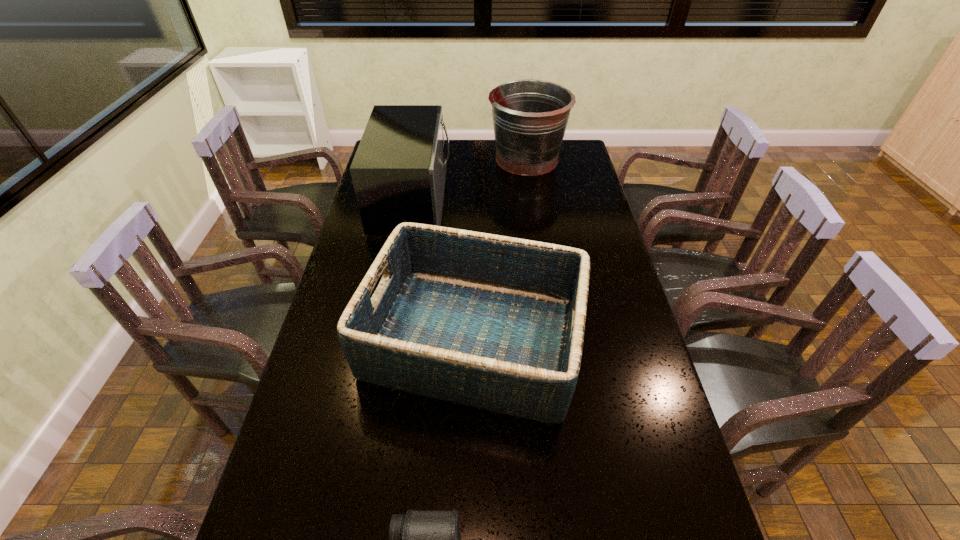
I want to click on bucket that is at the right edge, so click(530, 117).

Locate an element on the screen. The width and height of the screenshot is (960, 540). basket positioned at the right edge is located at coordinates (493, 322).

This screenshot has height=540, width=960. Find the location of `object situated at the far right corner`. object situated at the far right corner is located at coordinates (530, 117).

At what (x,y) coordinates should I click in order to perform the action: click on free space at the left edge. Please return your answer as a coordinate pair (x, y). Looking at the image, I should click on (x=335, y=311).

Find the location of `vacant space at the right edge of the desktop`. vacant space at the right edge of the desktop is located at coordinates (592, 299).

Find the location of a particular element. vacant region at the far right corner of the desktop is located at coordinates (577, 159).

I want to click on vacant space that is in between the bucket and the microwave oven, so click(x=469, y=180).

Locate which object is the third closest to the basket. Please provide its 2D coordinates. Your answer should be formatted as a tuple, i.e. [(x, y)], where the tuple contains the x and y coordinates of a point satisfying the conditions above.

[(530, 117)]

Point out which object is positioned as the third nearest to the microwave oven. Please provide its 2D coordinates. Your answer should be formatted as a tuple, i.e. [(x, y)], where the tuple contains the x and y coordinates of a point satisfying the conditions above.

[(419, 539)]

The width and height of the screenshot is (960, 540). Find the location of `vacant space that satisfies the following two spatial constraints: 1. with the door open on the microwave oven; 2. on the back side of the second shortest object`. vacant space that satisfies the following two spatial constraints: 1. with the door open on the microwave oven; 2. on the back side of the second shortest object is located at coordinates (387, 339).